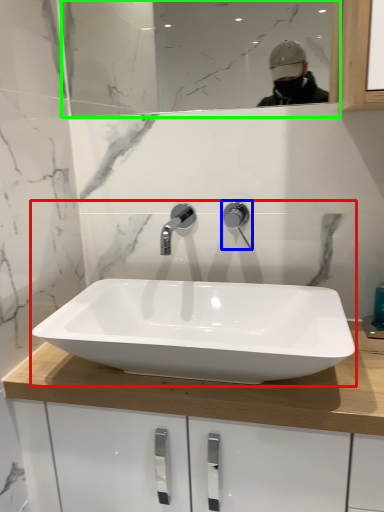
Question: Considering the real-world distances, which object is farthest from sink (highlighted by a red box)? tap (highlighted by a blue box) or mirror (highlighted by a green box)?

Choices:
 (A) tap
 (B) mirror

Answer: (B)